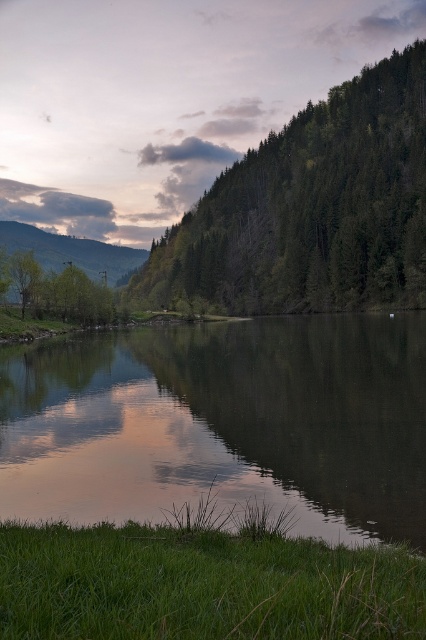
Consider the image. You are standing at the point labeled point (181,232) and want to walk to the point labeled point (8,237). Which direction should you face to move towards your destination?

You should face downward because point (8,237) is located below point (181,232) in the image.

You are a photographer standing at the edge of the smooth reflective water at center. You want to take a picture of the green matte tree at left. Can you see the top of the tree in your viewfinder?

The smooth reflective water at center is not as tall as green matte tree at left, so yes, you can see the top of the green matte tree at left in your viewfinder because it is taller than the water.

You are standing in the middle of the scene and want to walk towards the green matte tree at left. Which direction should you face to ensure the smooth reflective water at center is behind you?

You should face towards the green matte tree at left. Since the smooth reflective water at center is located below the green matte tree at left, facing the tree will place the water behind you.